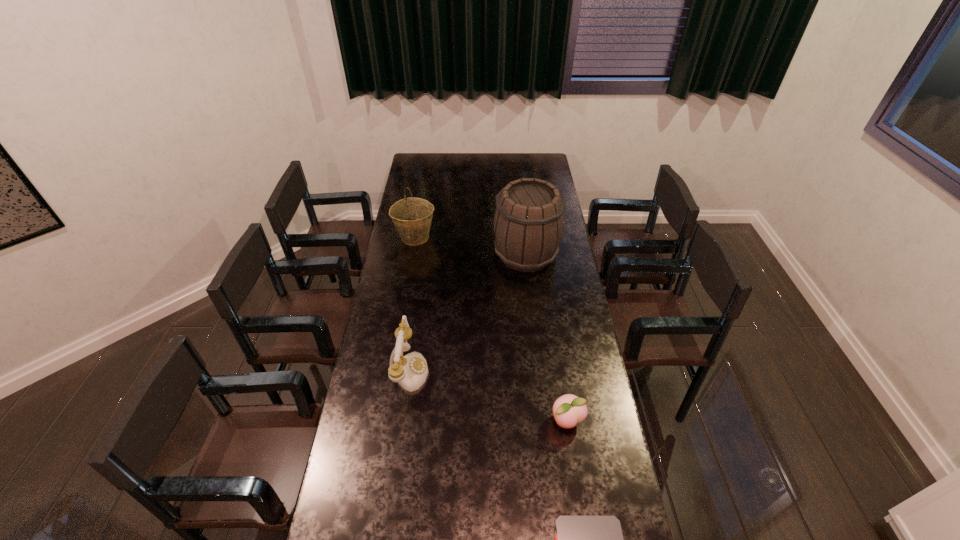
At what (x,y) coordinates should I click in order to perform the action: click on the tallest object. Please return your answer as a coordinate pair (x, y). The width and height of the screenshot is (960, 540). Looking at the image, I should click on (529, 222).

At what (x,y) coordinates should I click in order to perform the action: click on the right wine bucket. Please return your answer as a coordinate pair (x, y). The height and width of the screenshot is (540, 960). Looking at the image, I should click on tap(529, 222).

Find the location of a particular element. Image resolution: width=960 pixels, height=540 pixels. the fourth shortest object is located at coordinates (412, 216).

Locate an element on the screen. Image resolution: width=960 pixels, height=540 pixels. the shorter wine bucket is located at coordinates (412, 216).

The height and width of the screenshot is (540, 960). What are the coordinates of `the third tallest object` in the screenshot? It's located at (410, 371).

Image resolution: width=960 pixels, height=540 pixels. Find the location of `the third farthest object`. the third farthest object is located at coordinates (410, 371).

Where is `the second nearest object`? The height and width of the screenshot is (540, 960). the second nearest object is located at coordinates (569, 410).

At what (x,y) coordinates should I click in order to perform the action: click on the fourth tallest object. Please return your answer as a coordinate pair (x, y). Looking at the image, I should click on (569, 410).

At what (x,y) coordinates should I click in order to perform the action: click on vacant area situated on the front of the right wine bucket. Please return your answer as a coordinate pair (x, y). The height and width of the screenshot is (540, 960). Looking at the image, I should click on [x=535, y=334].

The width and height of the screenshot is (960, 540). Find the location of `vacant space situated on the right of the fourth shortest object`. vacant space situated on the right of the fourth shortest object is located at coordinates (515, 237).